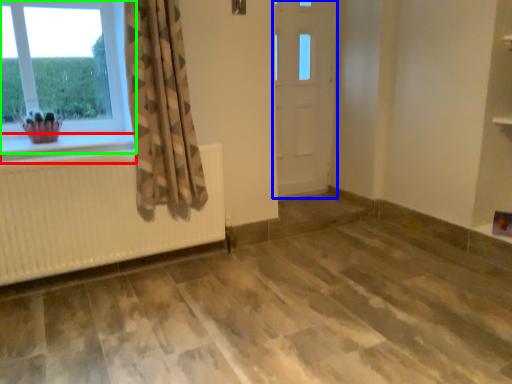
Question: Estimate the real-world distances between objects in this image. Which object is farther from window sill (highlighted by a red box), door (highlighted by a blue box) or window (highlighted by a green box)?

Choices:
 (A) door
 (B) window

Answer: (A)